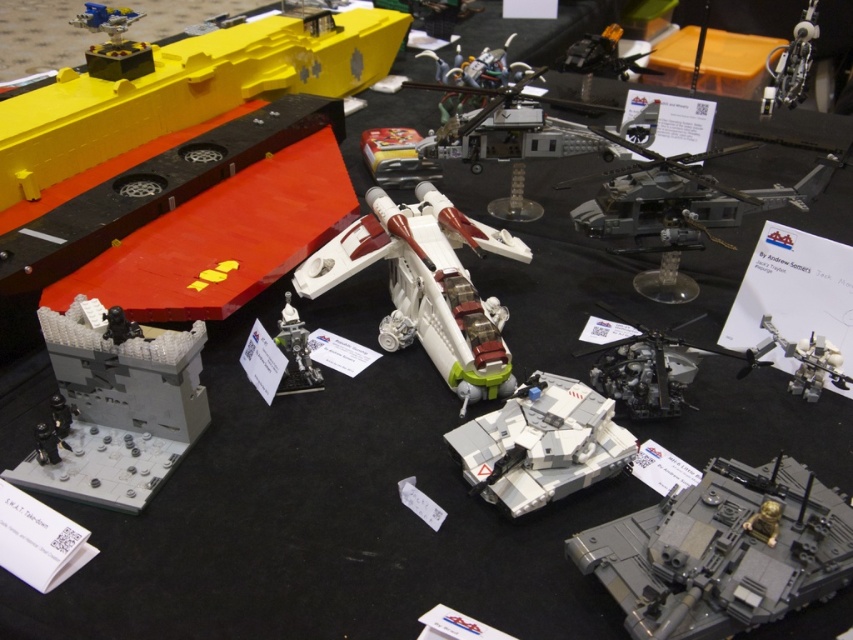
Is white plastic helicopter at center shorter than silver metallic figure at center?

Incorrect, white plastic helicopter at center's height does not fall short of silver metallic figure at center's.

Locate an element on the screen. This screenshot has width=853, height=640. white plastic helicopter at center is located at coordinates (426, 285).

Between point (399, 296) and point (312, 390), which one is positioned behind?

Point (399, 296)

Identify the location of white plastic helicopter at center. click(426, 285).

Can you confirm if metallic gray helicopter at center is shorter than metallic silver robot at center?

No, metallic gray helicopter at center is not shorter than metallic silver robot at center.

Who is more distant from viewer, (601,381) or (773,323)?

The point (773,323) is behind.

Where is `metallic gray helicopter at center`? The width and height of the screenshot is (853, 640). metallic gray helicopter at center is located at coordinates (654, 369).

Does metallic gray helicopter at upper right come behind silver metallic figure at center?

Yes, metallic gray helicopter at upper right is further from the viewer.

Who is shorter, metallic gray helicopter at upper right or silver metallic figure at center?

Standing shorter between the two is silver metallic figure at center.

The height and width of the screenshot is (640, 853). What do you see at coordinates (682, 211) in the screenshot? I see `metallic gray helicopter at upper right` at bounding box center [682, 211].

The image size is (853, 640). I want to click on metallic gray helicopter at upper right, so click(x=682, y=211).